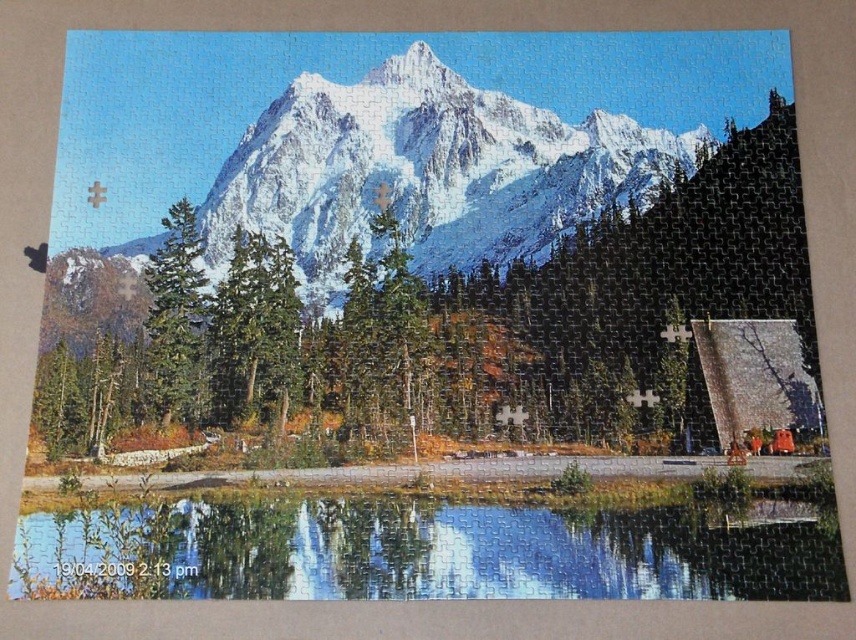
Does point (342, 337) come closer to viewer compared to point (293, 108)?

Yes, it is.

Between green matte tree at center and white snow-covered mountain at upper center, which one is positioned higher?

white snow-covered mountain at upper center is above.

Is point (698, 301) closer to camera compared to point (421, 144)?

Yes, it is.

The image size is (856, 640). Identify the location of green matte tree at center. (593, 304).

Can you confirm if white snow-covered mountain at upper center is positioned below green matte tree at center-left?

No.

Locate an element on the screen. white snow-covered mountain at upper center is located at coordinates (428, 170).

Who is positioned more to the right, green matte tree at center or green matte tree at center-left?

Positioned to the right is green matte tree at center.

Between point (569, 387) and point (189, 349), which one is positioned behind?

Positioned behind is point (189, 349).

This screenshot has height=640, width=856. What do you see at coordinates (593, 304) in the screenshot?
I see `green matte tree at center` at bounding box center [593, 304].

The width and height of the screenshot is (856, 640). Identify the location of green matte tree at center. (593, 304).